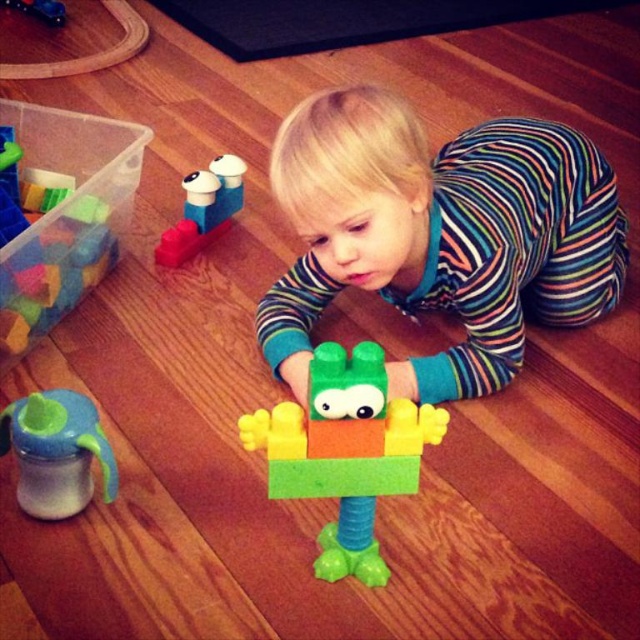
Question: Is blue rubber sippy cup at lower left below translucent plastic cup at upper left?

Choices:
 (A) yes
 (B) no

Answer: (A)

Question: Among these objects, which one is farthest from the camera?

Choices:
 (A) multicolored striped pajamas at center
 (B) blue rubber sippy cup at lower left
 (C) matte plastic train at upper left

Answer: (C)

Question: Among these objects, which one is nearest to the camera?

Choices:
 (A) matte plastic train at upper left
 (B) translucent plastic cup at upper left
 (C) blue rubber sippy cup at lower left

Answer: (C)

Question: Does matte plastic train at upper left have a lesser width compared to translucent plastic cup at upper left?

Choices:
 (A) no
 (B) yes

Answer: (B)

Question: Is green matte plastic toy at center smaller than matte plastic train at upper left?

Choices:
 (A) yes
 (B) no

Answer: (B)

Question: Which object is closer to the camera taking this photo?

Choices:
 (A) translucent plastic cup at upper left
 (B) blue rubber sippy cup at lower left
 (C) multicolored striped pajamas at center
 (D) matte plastic train at upper left

Answer: (B)